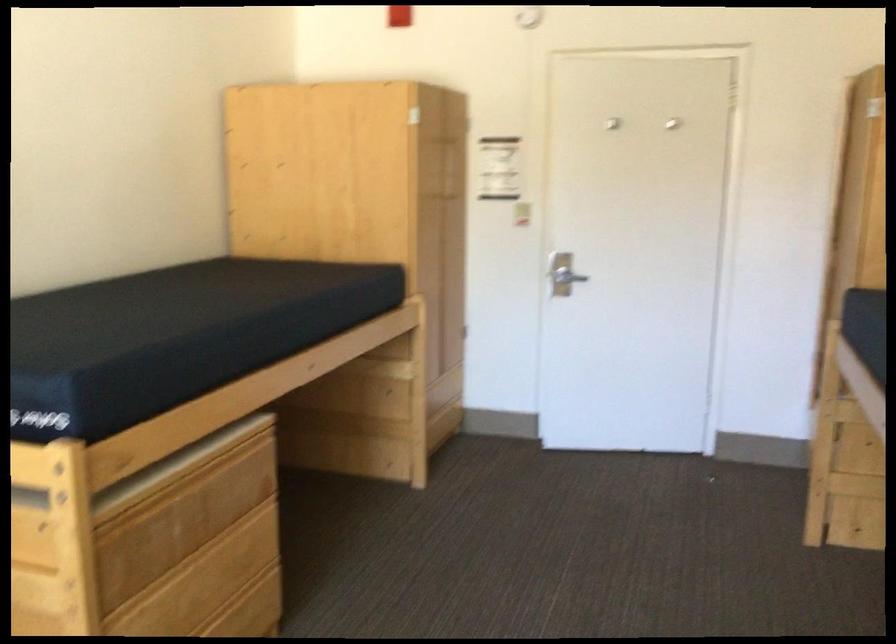
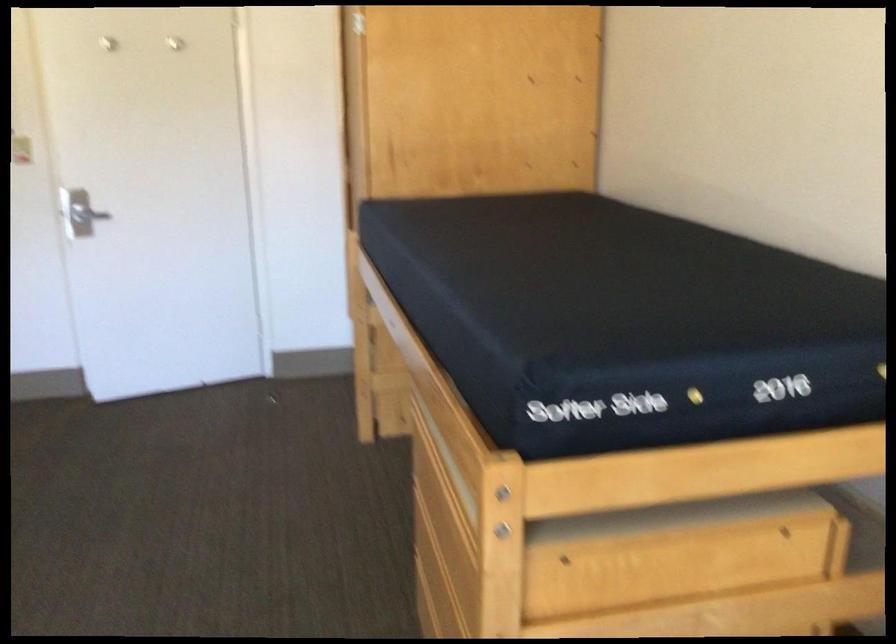
Locate, in the second image, the point that corresponds to (x=544, y=205) in the first image.

(21, 149)